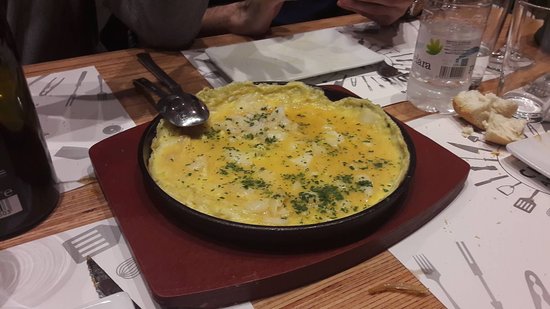
I want to click on spoon, so click(190, 122).